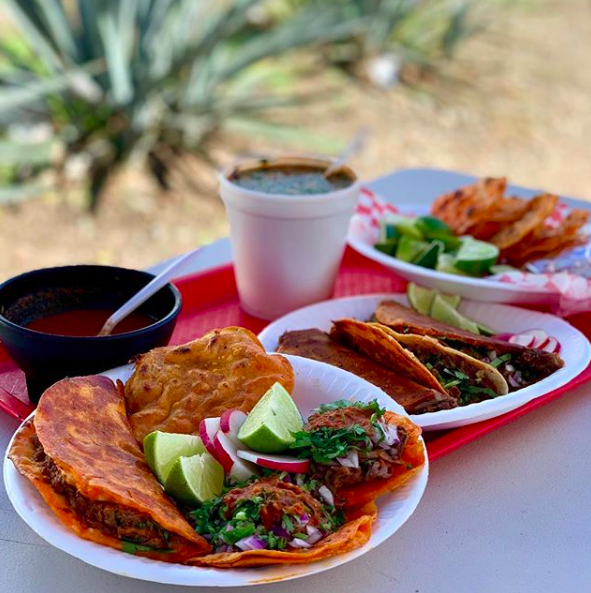
The width and height of the screenshot is (591, 593). Identify the location of spoon. (146, 290).